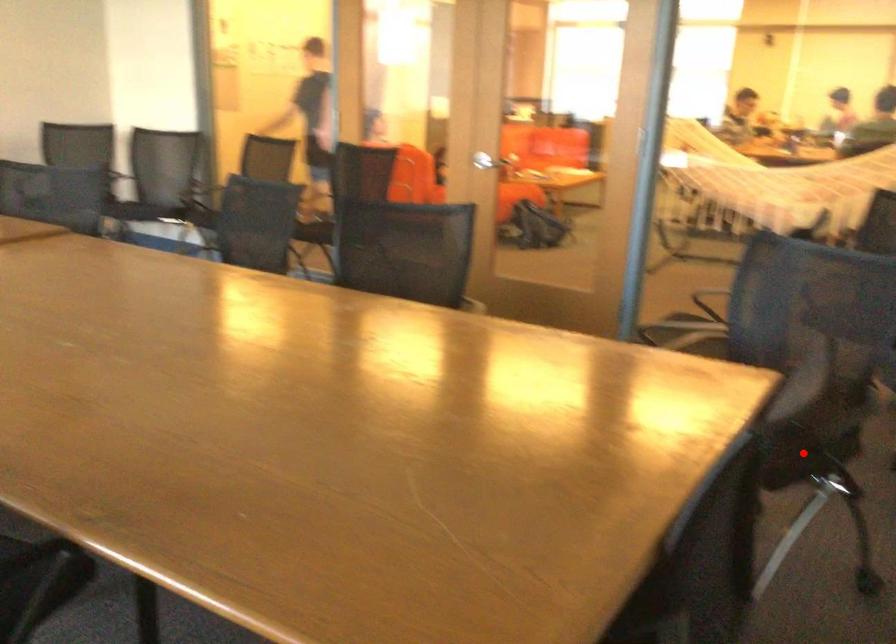
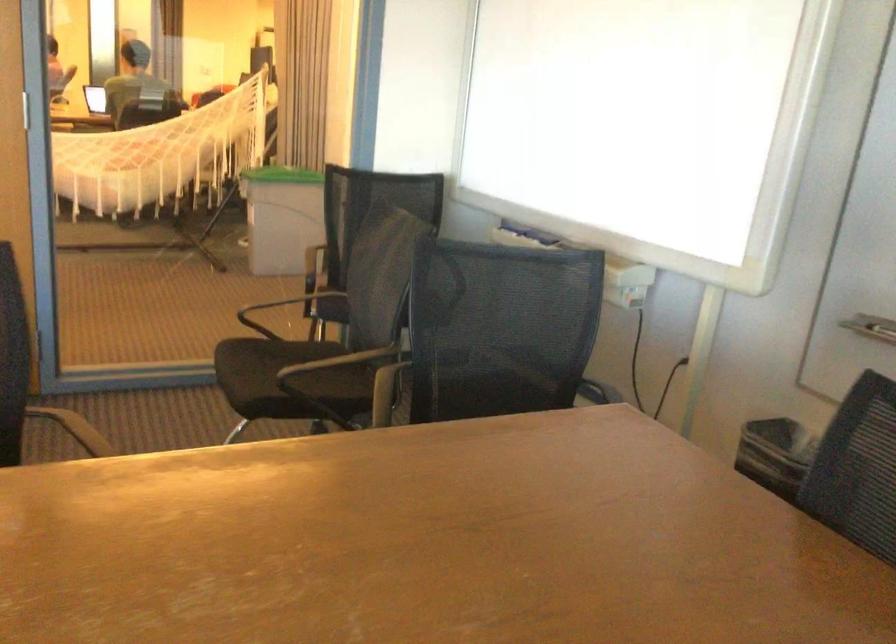
Question: I am providing you with two images of the same scene from different viewpoints. A red point is marked on the first image. At the location where the point appears in image 1, is it still visible in image 2?

Choices:
 (A) Yes
 (B) No

Answer: (B)